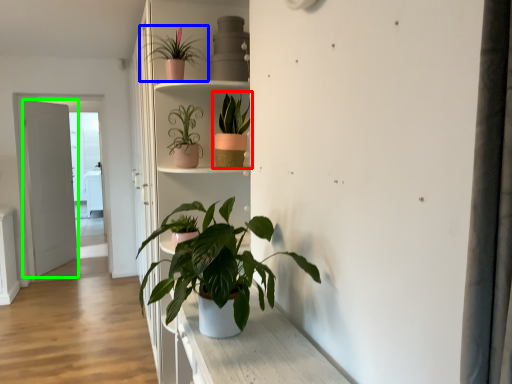
Question: Estimate the real-world distances between objects in this image. Which object is farther from houseplant (highlighted by a red box), houseplant (highlighted by a blue box) or door (highlighted by a green box)?

Choices:
 (A) houseplant
 (B) door

Answer: (B)